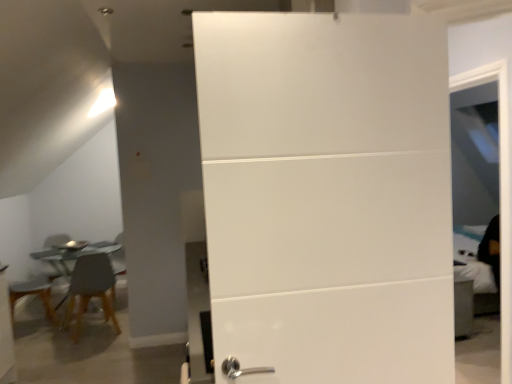
Question: Does point (414, 375) appear closer or farther from the camera than point (62, 249)?

Choices:
 (A) closer
 (B) farther

Answer: (A)

Question: In terms of height, does white glossy door at center look taller or shorter compared to metallic glass table at left?

Choices:
 (A) short
 (B) tall

Answer: (B)

Question: Estimate the real-world distances between objects in this image. Which object is farther from the matte brown wooden chair at left?

Choices:
 (A) white glossy door at center
 (B) metallic glass table at left

Answer: (A)

Question: Which object is the farthest from the metallic glass table at left?

Choices:
 (A) white glossy door at center
 (B) matte brown wooden chair at left

Answer: (A)